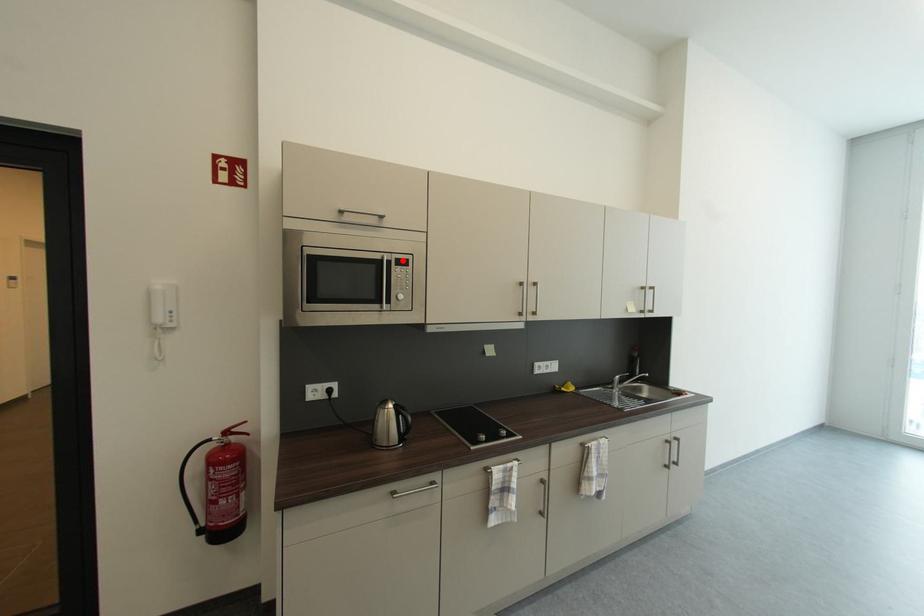
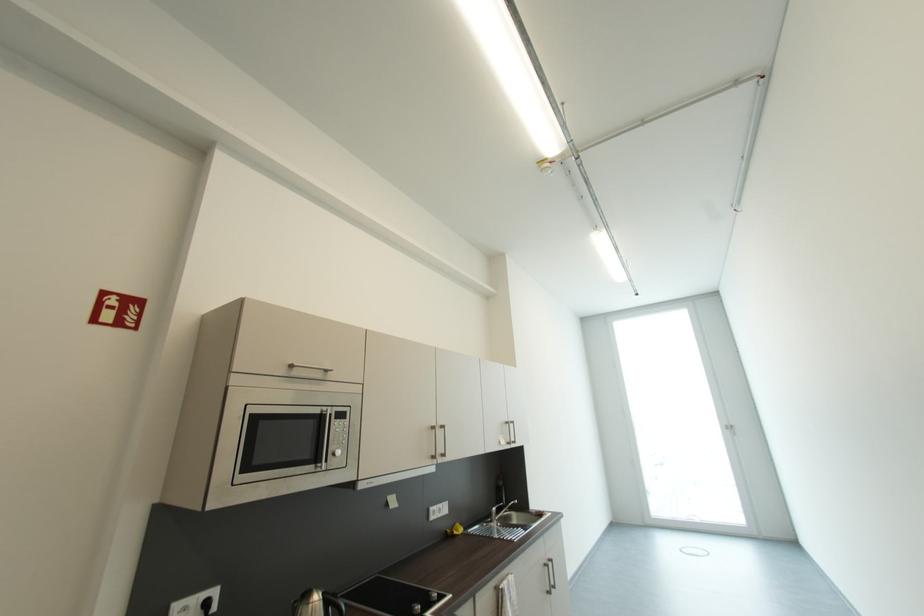
Where in the second image is the point corresponding to the highlighted location from the first image?

(342, 413)